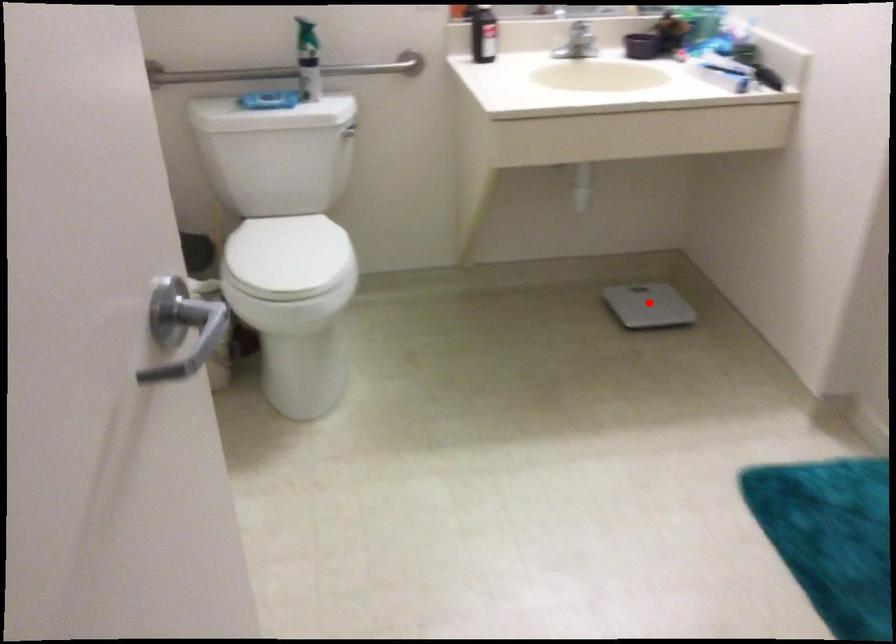
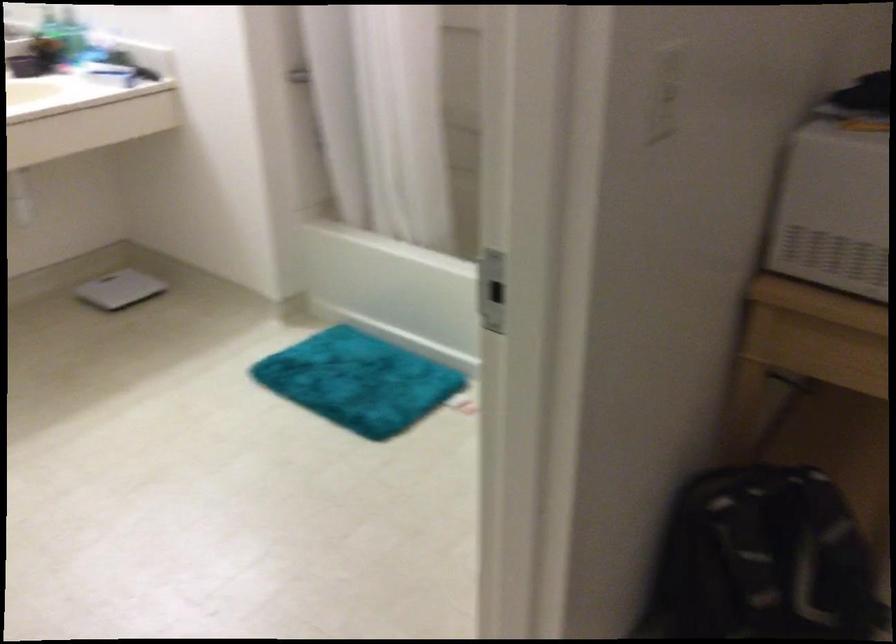
Locate, in the second image, the point that corresponds to the highlighted location in the first image.

(119, 289)